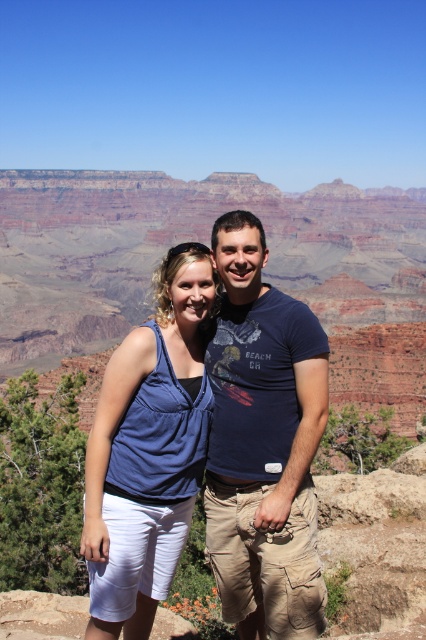
Question: Is dark blue cotton t-shirt at center smaller than blue fabric tank top at center?

Choices:
 (A) yes
 (B) no

Answer: (B)

Question: Which point is closer to the camera?

Choices:
 (A) (193, 349)
 (B) (278, 547)

Answer: (B)

Question: Can you confirm if dark blue cotton t-shirt at center is wider than blue fabric tank top at center?

Choices:
 (A) no
 (B) yes

Answer: (A)

Question: Which of the following is the closest to the observer?

Choices:
 (A) blue fabric tank top at center
 (B) dark blue cotton t-shirt at center

Answer: (B)

Question: Does dark blue cotton t-shirt at center have a greater width compared to blue fabric tank top at center?

Choices:
 (A) no
 (B) yes

Answer: (A)